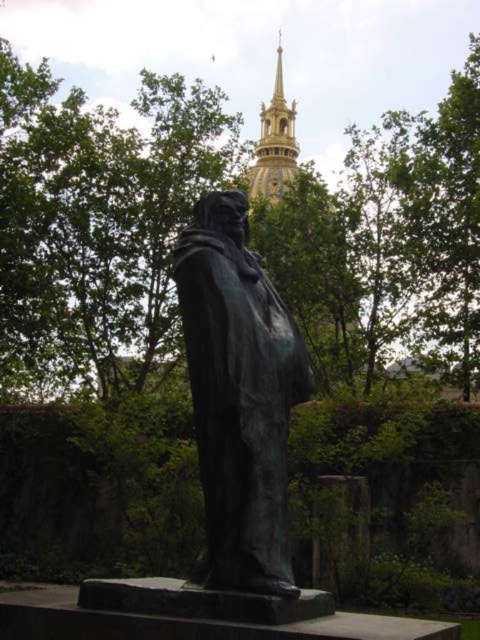
Question: Can you confirm if bronze statue at center is positioned to the left of gold textured spire at upper center?

Choices:
 (A) yes
 (B) no

Answer: (A)

Question: Is bronze statue at center positioned before gold textured spire at upper center?

Choices:
 (A) yes
 (B) no

Answer: (A)

Question: Among these objects, which one is nearest to the camera?

Choices:
 (A) gold textured spire at upper center
 (B) bronze statue at center

Answer: (B)

Question: Which object appears farthest from the camera in this image?

Choices:
 (A) gold textured spire at upper center
 (B) bronze statue at center

Answer: (A)

Question: Can you confirm if bronze statue at center is positioned above gold textured spire at upper center?

Choices:
 (A) yes
 (B) no

Answer: (B)